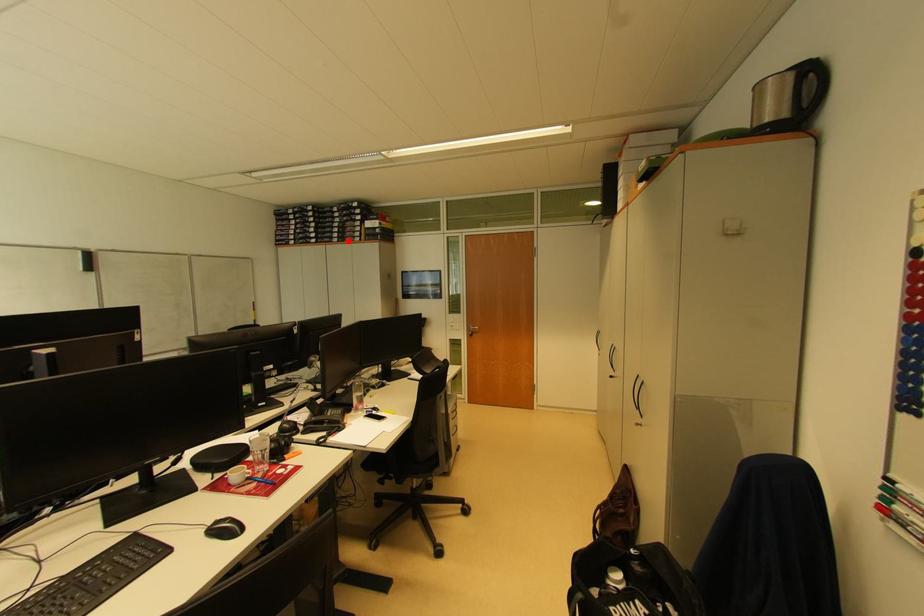
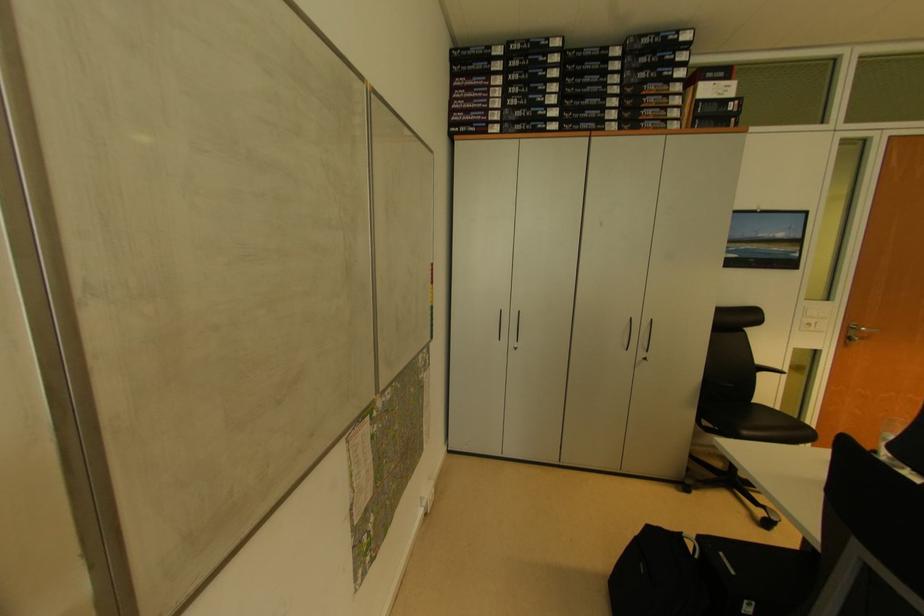
Locate, in the second image, the point that corresponds to the highlighted location in the first image.

(646, 124)